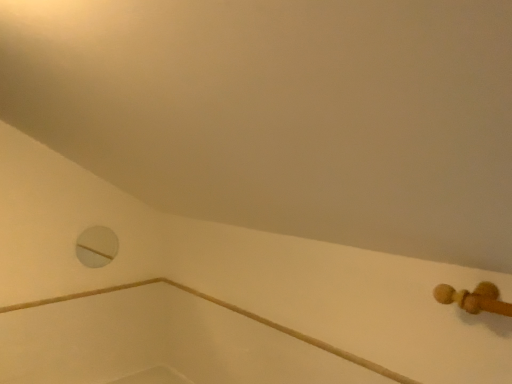
Question: From the image's perspective, is white matte hole at upper left located above wooden rail at lower right?

Choices:
 (A) no
 (B) yes

Answer: (B)

Question: Does white matte hole at upper left have a smaller size compared to wooden rail at lower right?

Choices:
 (A) yes
 (B) no

Answer: (A)

Question: Is white matte hole at upper left bigger than wooden rail at lower right?

Choices:
 (A) no
 (B) yes

Answer: (A)

Question: Is white matte hole at upper left oriented towards wooden rail at lower right?

Choices:
 (A) yes
 (B) no

Answer: (A)

Question: Can you confirm if white matte hole at upper left is positioned to the left of wooden rail at lower right?

Choices:
 (A) yes
 (B) no

Answer: (A)

Question: From a real-world perspective, is white matte hole at upper left positioned over wooden rail at lower right based on gravity?

Choices:
 (A) no
 (B) yes

Answer: (B)

Question: Are wooden rail at lower right and white matte hole at upper left far apart?

Choices:
 (A) yes
 (B) no

Answer: (B)

Question: Is the position of wooden rail at lower right more distant than that of white matte hole at upper left?

Choices:
 (A) yes
 (B) no

Answer: (B)

Question: Can you confirm if wooden rail at lower right is taller than white matte hole at upper left?

Choices:
 (A) yes
 (B) no

Answer: (B)

Question: From the image's perspective, is wooden rail at lower right over white matte hole at upper left?

Choices:
 (A) no
 (B) yes

Answer: (A)

Question: Can we say wooden rail at lower right lies outside white matte hole at upper left?

Choices:
 (A) no
 (B) yes

Answer: (B)

Question: From a real-world perspective, does wooden rail at lower right sit lower than white matte hole at upper left?

Choices:
 (A) no
 (B) yes

Answer: (B)

Question: Considering the positions of wooden rail at lower right and white matte hole at upper left in the image, is wooden rail at lower right taller or shorter than white matte hole at upper left?

Choices:
 (A) tall
 (B) short

Answer: (B)